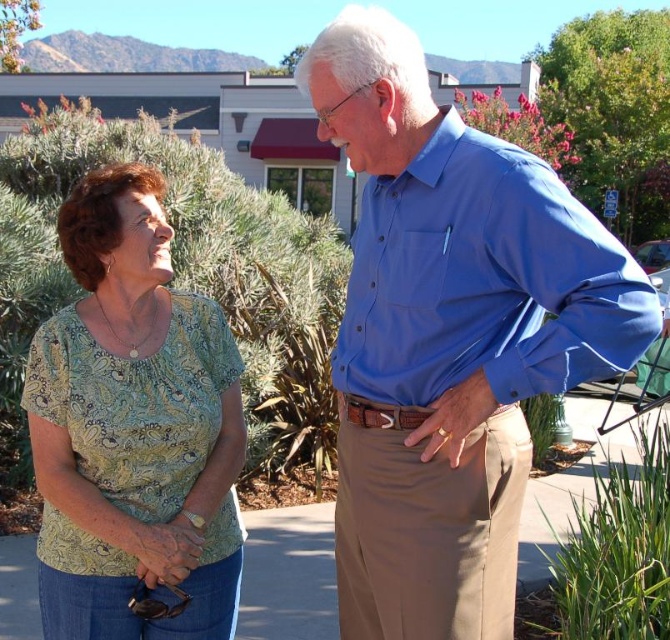
You are holding a camera and want to take a photo of the scene. The camera is currently positioned at a point that is 1.75 meters away from the point at coordinates (525,252). If you move the camera 0.5 meters closer to that point, how far will the camera be from the point?

The camera was initially 1.75 meters away from the point. Moving it 0.5 meters closer reduces the distance to 1.75 meters minus 0.5 meters, resulting in a new distance of 1.25 meters from the point.

You are a photographer trying to capture a group photo of the two people in the scene. The camera you are using has a frame that can only accommodate clothing items with a width of up to 40 cm. Given the blue cotton shirt at center and the green paisley blouse at left, which one might not fit within the camera frame if their actual widths are as described?

The blue cotton shirt at center has a larger width than the green paisley blouse at left, so it might not fit within the camera frame if its width exceeds 40 cm.

You are a photographer trying to capture a photo of the blue cotton shirt at center and the green paisley blouse at left. You want to ensure both are visible in the frame. Based on their positions, which one should you focus on first to make sure they are both in the frame?

The blue cotton shirt at center is above the green paisley blouse at left, so you should focus on the blue cotton shirt at center first to ensure both are in the frame.